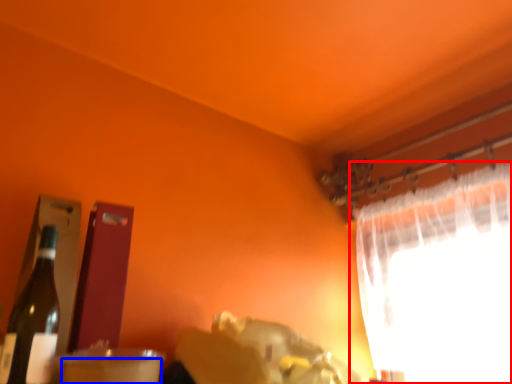
Question: Which point is closer to the camera, curtain (highlighted by a red box) or drinking straw (highlighted by a blue box)?

Choices:
 (A) curtain
 (B) drinking straw

Answer: (B)